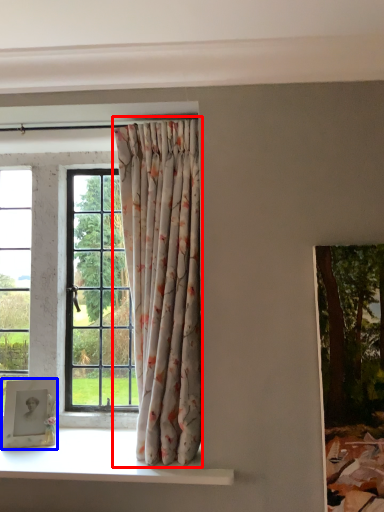
Question: Among these objects, which one is farthest to the camera, curtain (highlighted by a red box) or picture frame (highlighted by a blue box)?

Choices:
 (A) curtain
 (B) picture frame

Answer: (B)